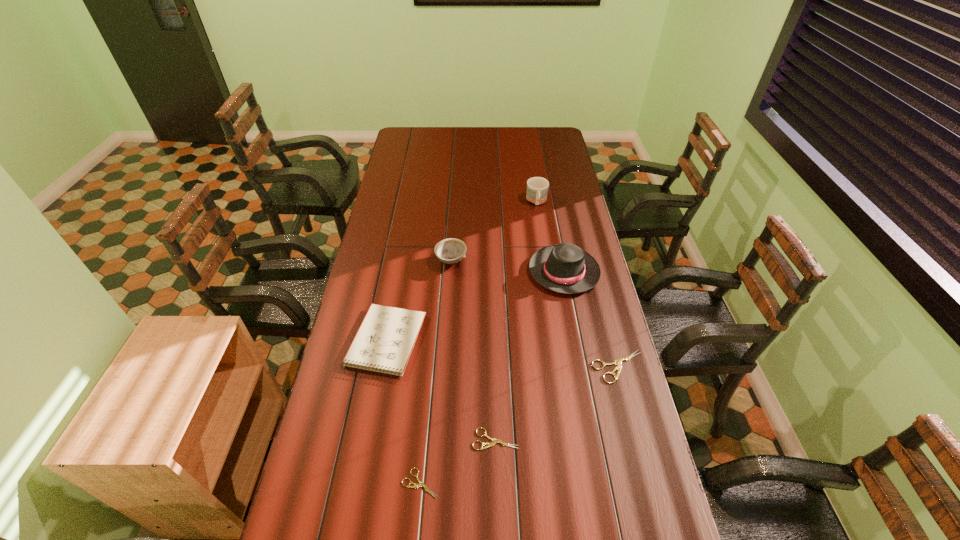
Identify which shears is located as the nearest to the mug. Please provide its 2D coordinates. Your answer should be formatted as a tuple, i.e. [(x, y)], where the tuple contains the x and y coordinates of a point satisfying the conditions above.

[(618, 361)]

Identify which shears is the closest to the notepad. Please provide its 2D coordinates. Your answer should be formatted as a tuple, i.e. [(x, y)], where the tuple contains the x and y coordinates of a point satisfying the conditions above.

[(489, 444)]

This screenshot has width=960, height=540. Identify the location of free space that satisfies the following two spatial constraints: 1. on the back side of the nearest shears; 2. on the left side of the fifth shortest object. (441, 260).

Identify the location of free space in the image that satisfies the following two spatial constraints: 1. on the back side of the nearest shears; 2. on the right side of the dress hat. (440, 272).

Where is `vacant space that satisfies the following two spatial constraints: 1. on the back side of the second shortest shears; 2. on the right side of the dress hat`? The image size is (960, 540). vacant space that satisfies the following two spatial constraints: 1. on the back side of the second shortest shears; 2. on the right side of the dress hat is located at coordinates (492, 272).

The image size is (960, 540). In order to click on free space that satisfies the following two spatial constraints: 1. on the front side of the fourth tallest object; 2. on the right side of the nearest shears in this screenshot , I will do `click(361, 483)`.

Where is `vacant space that satisfies the following two spatial constraints: 1. on the side with the handle of the farthest shears; 2. on the right side of the mug`? The width and height of the screenshot is (960, 540). vacant space that satisfies the following two spatial constraints: 1. on the side with the handle of the farthest shears; 2. on the right side of the mug is located at coordinates (562, 367).